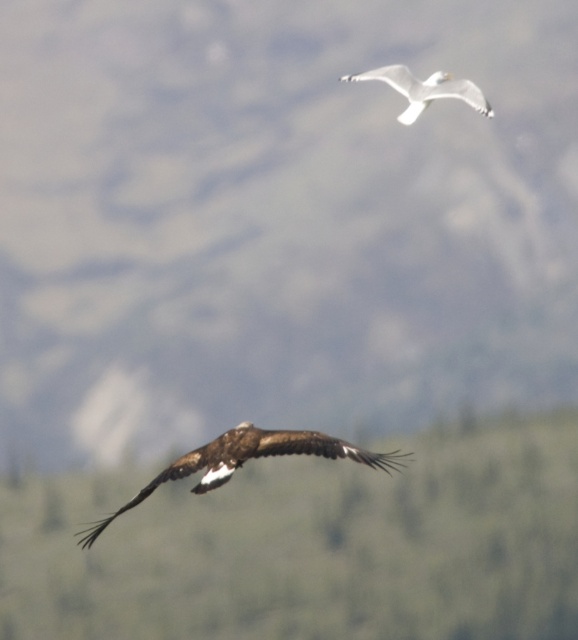
Question: Which point is closer to the camera taking this photo?

Choices:
 (A) (264, 541)
 (B) (250, 445)
 (C) (479, 109)

Answer: (B)

Question: Observing the image, what is the correct spatial positioning of brown textured tree at lower center in reference to white matte bird at upper center?

Choices:
 (A) left
 (B) right

Answer: (A)

Question: Is brown textured tree at lower center smaller than white matte bird at upper center?

Choices:
 (A) no
 (B) yes

Answer: (A)

Question: Estimate the real-world distances between objects in this image. Which object is farther from the white matte bird at upper center?

Choices:
 (A) brown feathered eagle at center
 (B) brown textured tree at lower center

Answer: (A)

Question: Can you confirm if brown textured tree at lower center is thinner than white matte bird at upper center?

Choices:
 (A) yes
 (B) no

Answer: (B)

Question: Which of the following is the closest to the observer?

Choices:
 (A) brown textured tree at lower center
 (B) brown feathered eagle at center

Answer: (B)